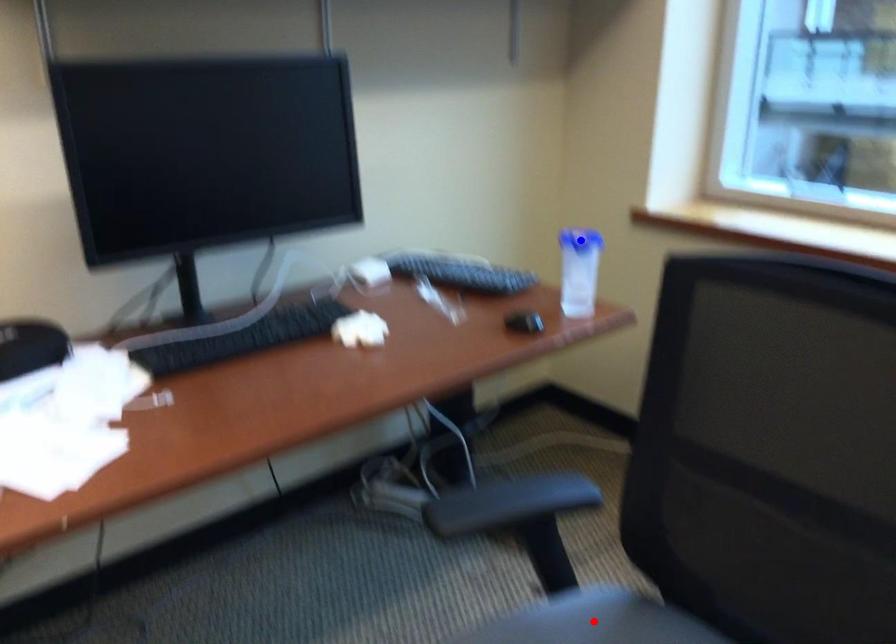
Question: Which of the two points in the image is closer to the camera?

Choices:
 (A) Blue point is closer.
 (B) Red point is closer.

Answer: (B)